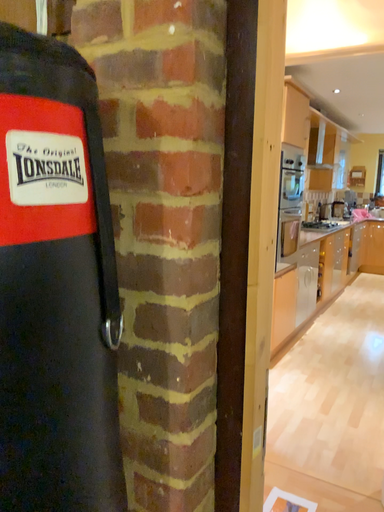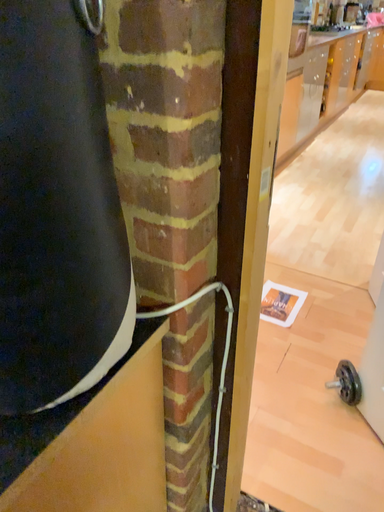
Question: How did the camera likely rotate when shooting the video?

Choices:
 (A) rotated downward
 (B) rotated upward

Answer: (A)